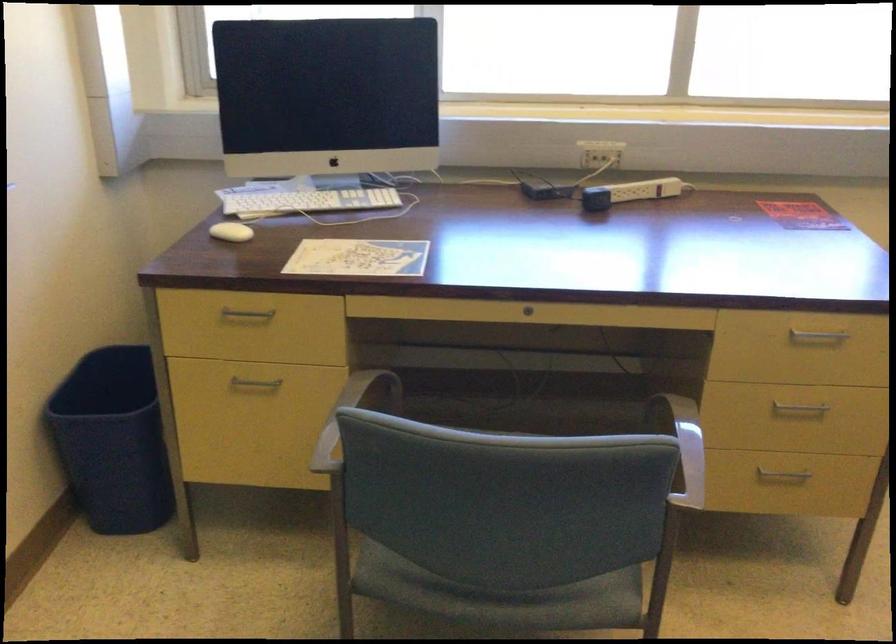
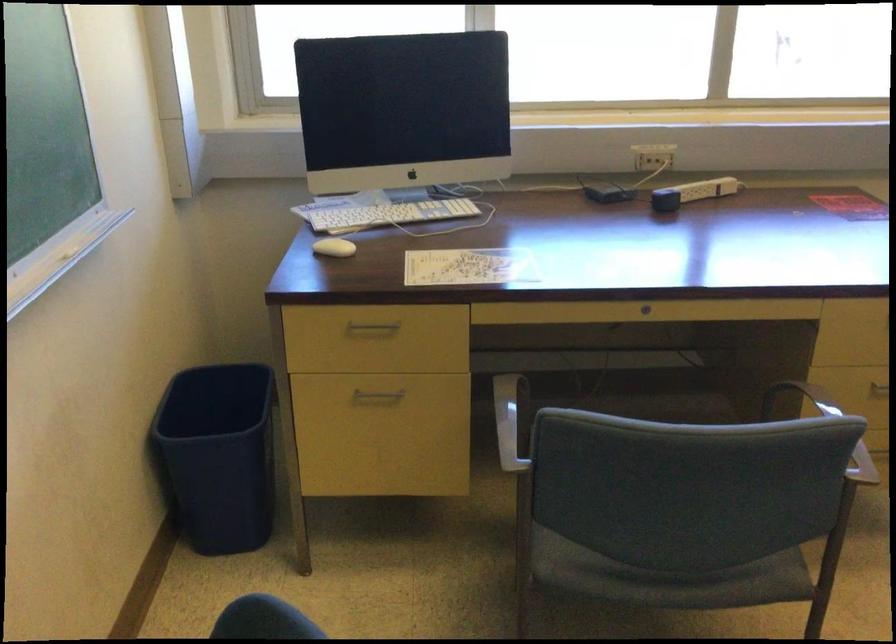
Find the pixel in the second image that matches the point at 231,234 in the first image.

(333, 247)